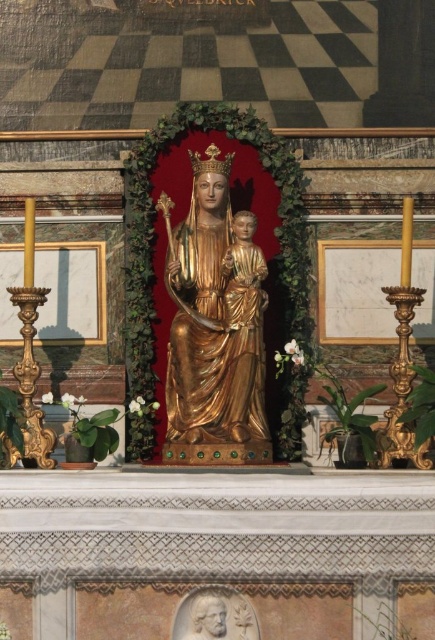
Question: Does gold polished statue at center appear under white marble bust at lower center?

Choices:
 (A) no
 (B) yes

Answer: (A)

Question: Does gold polished statue at center come behind white marble bust at lower center?

Choices:
 (A) yes
 (B) no

Answer: (A)

Question: In this image, where is gold polished statue at center located relative to white marble bust at lower center?

Choices:
 (A) above
 (B) below

Answer: (A)

Question: Which point is closer to the camera?

Choices:
 (A) gold polished statue at center
 (B) white marble bust at lower center

Answer: (B)

Question: Which object is closer to the camera taking this photo?

Choices:
 (A) white marble bust at lower center
 (B) gold polished statue at center

Answer: (A)